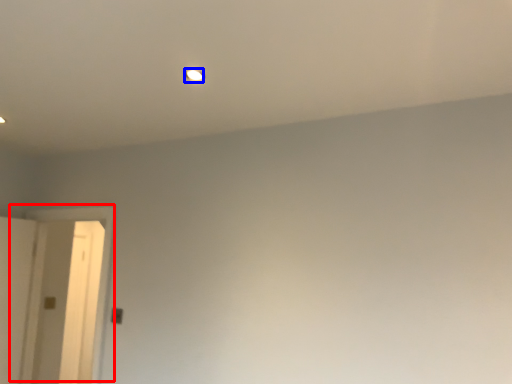
Question: Among these objects, which one is farthest to the camera, door (highlighted by a red box) or light (highlighted by a blue box)?

Choices:
 (A) door
 (B) light

Answer: (A)